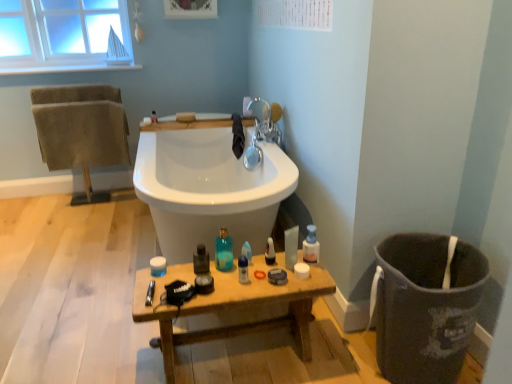
Where is `free space to the left of translucent plastic spray bottle at center, arranged as the second cleaning product when viewed from the right`? The height and width of the screenshot is (384, 512). free space to the left of translucent plastic spray bottle at center, arranged as the second cleaning product when viewed from the right is located at coordinates (212, 268).